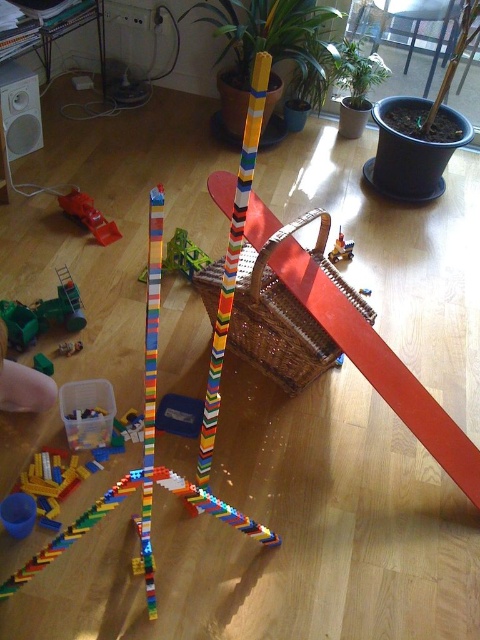
Consider the image. Is rubberized red toy car at lower left to the right of matte plastic toy at center from the viewer's perspective?

Incorrect, rubberized red toy car at lower left is not on the right side of matte plastic toy at center.

Does point (101, 221) lie in front of point (335, 244)?

Yes, it is.

At what (x,y) coordinates should I click in order to perform the action: click on rubberized red toy car at lower left. Please return your answer as a coordinate pair (x, y). Looking at the image, I should click on (88, 216).

Where is `translucent plastic toy at center`? The image size is (480, 640). translucent plastic toy at center is located at coordinates (182, 256).

Between translucent plastic toy at center and green matte toy at lower left, which one is positioned higher?

translucent plastic toy at center is higher up.

Is point (187, 264) farther from viewer compared to point (43, 355)?

Yes, it is behind point (43, 355).

You are a GUI agent. You are given a task and a screenshot of the screen. Output one action in this format:
    pyautogui.click(x=<x>, y=<y>)
    Task: Click on the translucent plastic toy at center
    The width and height of the screenshot is (480, 640).
    Given the screenshot: What is the action you would take?
    pyautogui.click(x=182, y=256)

Is point (24, 388) closer to camera compared to point (79, 346)?

Yes, it is in front of point (79, 346).

Is point (41, 401) positioned after point (60, 355)?

No.

The height and width of the screenshot is (640, 480). I want to click on smooth skin hand at lower left, so click(23, 384).

Where is `smooth skin hand at lower left`? The image size is (480, 640). smooth skin hand at lower left is located at coordinates (23, 384).